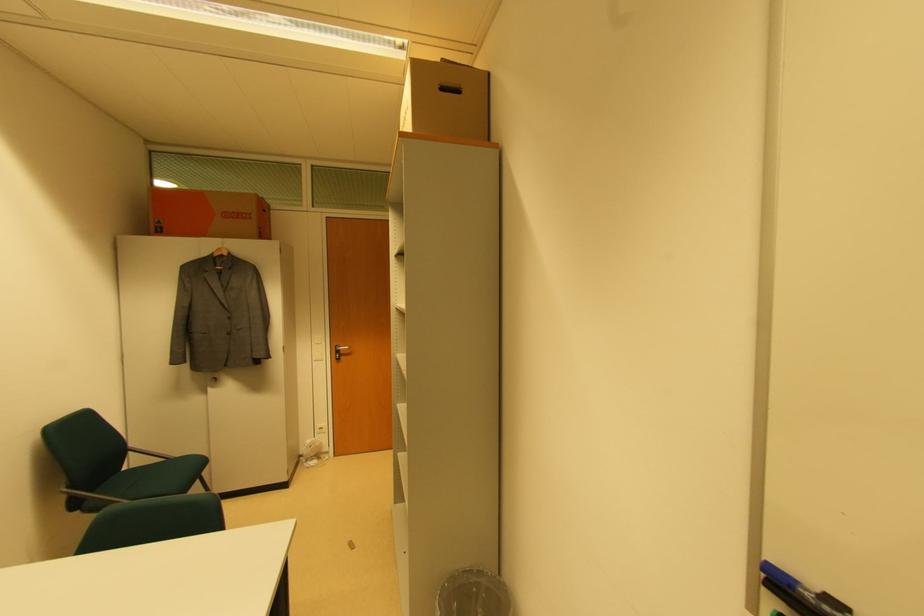
Where would you pull the silver door handle? Please return your answer as a coordinate pair (x, y).

(342, 347)